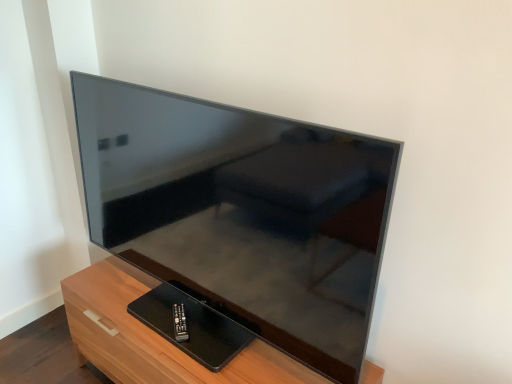
Find the location of `free region under matte black tv at center (from a real-world perspective)`. free region under matte black tv at center (from a real-world perspective) is located at coordinates (187, 324).